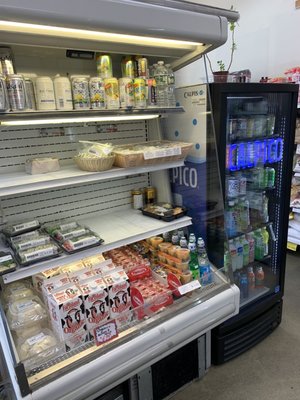
This screenshot has height=400, width=300. What are the coordinates of `white label on shelf` in the screenshot? It's located at (105, 330).